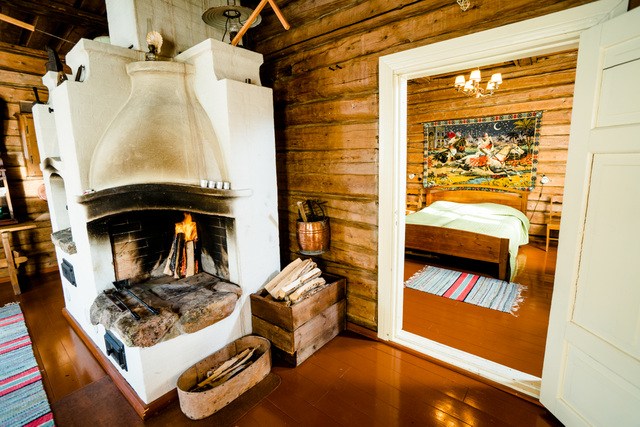
The width and height of the screenshot is (640, 427). What are the coordinates of `fireplace tools` in the screenshot? It's located at (140, 301), (129, 309).